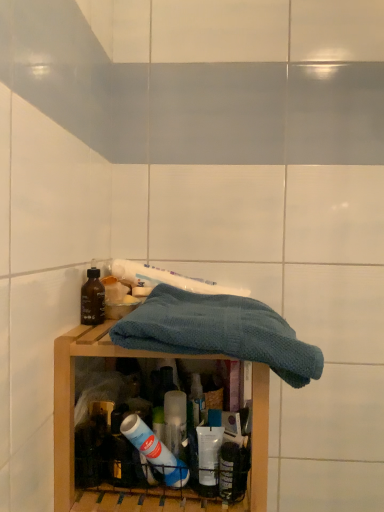
Question: Should I look upward or downward to see wooden shelf at center?

Choices:
 (A) up
 (B) down

Answer: (B)

Question: Considering the relative sizes of white glossy toothpaste at center and matte brown bottle at left in the image provided, is white glossy toothpaste at center smaller than matte brown bottle at left?

Choices:
 (A) no
 (B) yes

Answer: (A)

Question: Is white glossy toothpaste at center placed right next to matte brown bottle at left?

Choices:
 (A) no
 (B) yes

Answer: (A)

Question: From the image's perspective, does white glossy toothpaste at center appear lower than matte brown bottle at left?

Choices:
 (A) yes
 (B) no

Answer: (B)

Question: Does white glossy toothpaste at center contain matte brown bottle at left?

Choices:
 (A) no
 (B) yes

Answer: (A)

Question: Is white glossy toothpaste at center bigger than matte brown bottle at left?

Choices:
 (A) no
 (B) yes

Answer: (B)

Question: Can you confirm if white glossy toothpaste at center is thinner than matte brown bottle at left?

Choices:
 (A) no
 (B) yes

Answer: (A)

Question: Does white glossy toothpaste at center appear on the right side of blue knitted towel at center?

Choices:
 (A) yes
 (B) no

Answer: (B)

Question: Is white glossy toothpaste at center directly adjacent to blue knitted towel at center?

Choices:
 (A) no
 (B) yes

Answer: (A)

Question: Is the depth of white glossy toothpaste at center less than that of blue knitted towel at center?

Choices:
 (A) no
 (B) yes

Answer: (A)

Question: Is white glossy toothpaste at center located outside blue knitted towel at center?

Choices:
 (A) no
 (B) yes

Answer: (B)

Question: Does white glossy toothpaste at center have a larger size compared to blue knitted towel at center?

Choices:
 (A) yes
 (B) no

Answer: (B)

Question: Does white glossy toothpaste at center lie behind blue knitted towel at center?

Choices:
 (A) yes
 (B) no

Answer: (A)

Question: Is wooden shelf at center positioned with its back to matte brown bottle at left?

Choices:
 (A) no
 (B) yes

Answer: (A)